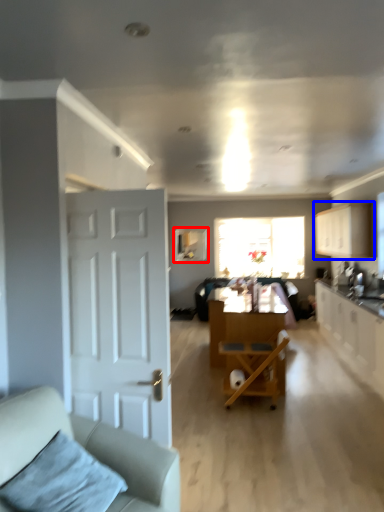
Question: Which of the following is the closest to the observer, window screen (highlighted by a red box) or cabinetry (highlighted by a blue box)?

Choices:
 (A) window screen
 (B) cabinetry

Answer: (B)